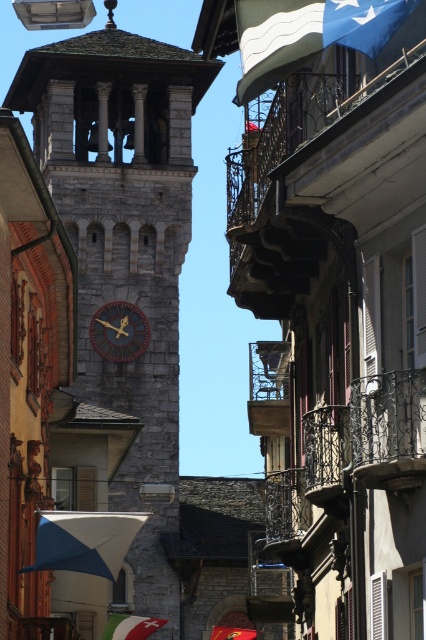
You are a tourist standing in front of the historic street scene. You notice the stone clock tower at center and the blue fabric flag at upper right. Which object would appear closer to you in the image?

The stone clock tower at center appears closer to you because it is larger in size than the blue fabric flag at upper right, and size is an indicator of proximity in visual perception.

You are an architect designing a new street layout. You need to ensure that the blue fabric flag at upper right and the wooden clock at center are visible from a distance. Based on their sizes, which object would be more noticeable from afar?

The blue fabric flag at upper right has a larger width than the wooden clock at center, making it more noticeable from a distance.

You are a tourist standing in front of the historic stone clock tower. You notice a blue fabric umbrella at center and a green fabric flag at center. Which object is positioned to the right side?

The blue fabric umbrella at center is positioned to the right of the green fabric flag at center.